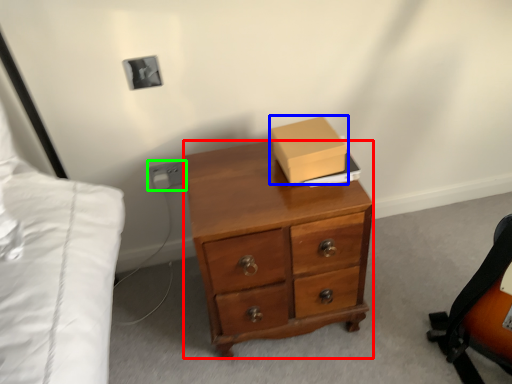
Question: Which object is positioned farthest from desk (highlighted by a red box)? Select from box (highlighted by a blue box) and electric outlet (highlighted by a green box).

Choices:
 (A) box
 (B) electric outlet

Answer: (B)